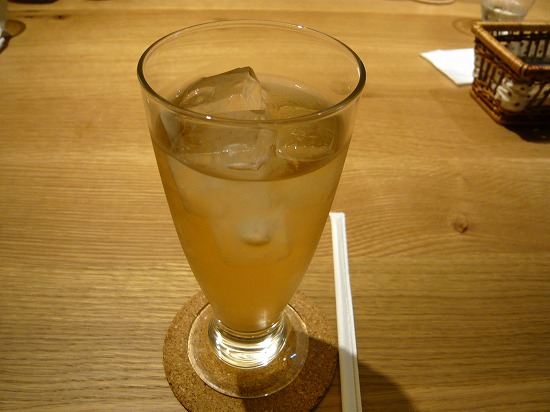
Locate an element on the screen. The height and width of the screenshot is (412, 550). wooden table is located at coordinates (474, 307), (102, 330), (82, 138), (382, 48).